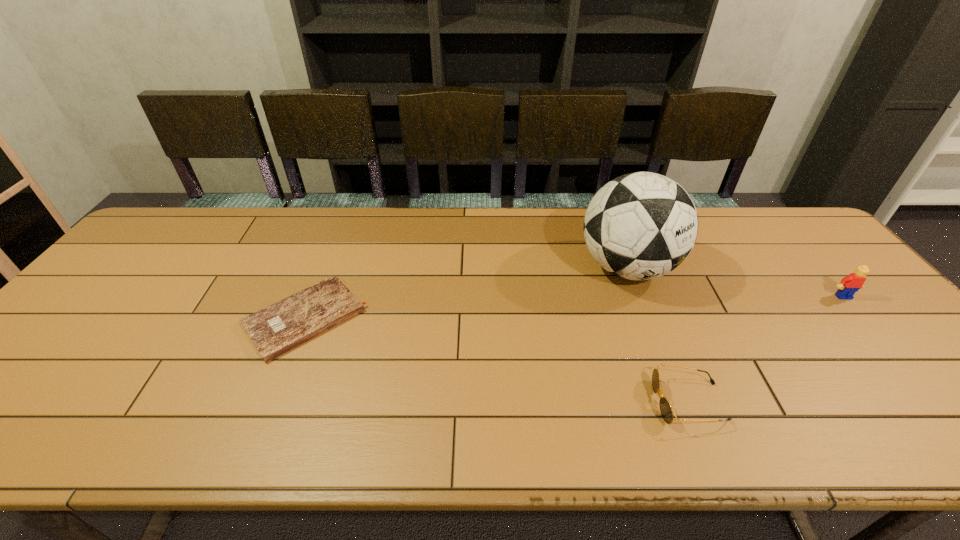
Where is `vacant point located between the second shortest object and the soccer ball`? Image resolution: width=960 pixels, height=540 pixels. vacant point located between the second shortest object and the soccer ball is located at coordinates (658, 335).

Locate which object ranks second in proximity to the nearest object. Please provide its 2D coordinates. Your answer should be formatted as a tuple, i.e. [(x, y)], where the tuple contains the x and y coordinates of a point satisfying the conditions above.

[(850, 284)]

The image size is (960, 540). What are the coordinates of `object that can be found as the closest to the tallest object` in the screenshot? It's located at (666, 411).

The image size is (960, 540). In order to click on vacant space that satisfies the following two spatial constraints: 1. on the face of the rightmost object; 2. on the front-facing side of the sunglasses in this screenshot , I will do `click(935, 402)`.

Find the location of a particular element. The image size is (960, 540). free space that satisfies the following two spatial constraints: 1. on the face of the rightmost object; 2. on the front-facing side of the nearest object is located at coordinates tap(935, 402).